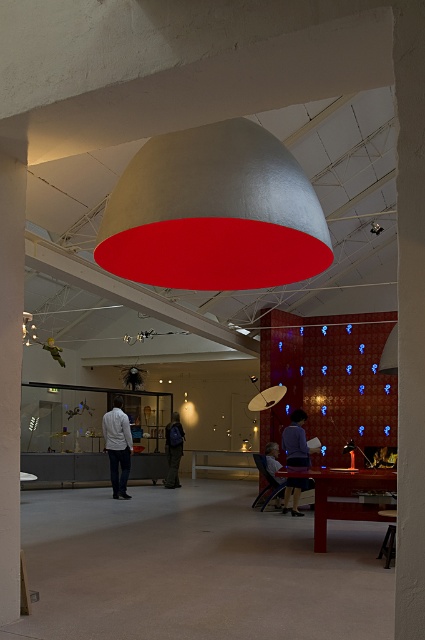
What do you see at coordinates (118, 445) in the screenshot? I see `white matte jacket at center` at bounding box center [118, 445].

Is white matte jacket at center below blue backpack at center?

Actually, white matte jacket at center is above blue backpack at center.

Who is more forward, (116, 481) or (181, 451)?

Point (116, 481) is in front.

Where is `white matte jacket at center`? white matte jacket at center is located at coordinates (118, 445).

Does blue fabric shirt at center lie in front of matte black shirt at lower center?

Yes, blue fabric shirt at center is closer to the viewer.

Who is shorter, blue fabric shirt at center or matte black shirt at lower center?

matte black shirt at lower center

Identify the location of blue fabric shirt at center. Image resolution: width=425 pixels, height=640 pixels. (295, 440).

At what (x,y) coordinates should I click in order to perform the action: click on blue fabric shirt at center. Please return your answer as a coordinate pair (x, y). The height and width of the screenshot is (640, 425). Looking at the image, I should click on tap(295, 440).

Who is higher up, white glossy pillar at left or matte black shirt at lower center?

Positioned higher is white glossy pillar at left.

How distant is white glossy pillar at left from matte black shirt at lower center?

The distance of white glossy pillar at left from matte black shirt at lower center is 7.08 meters.

This screenshot has width=425, height=640. Identify the location of white glossy pillar at left. (11, 364).